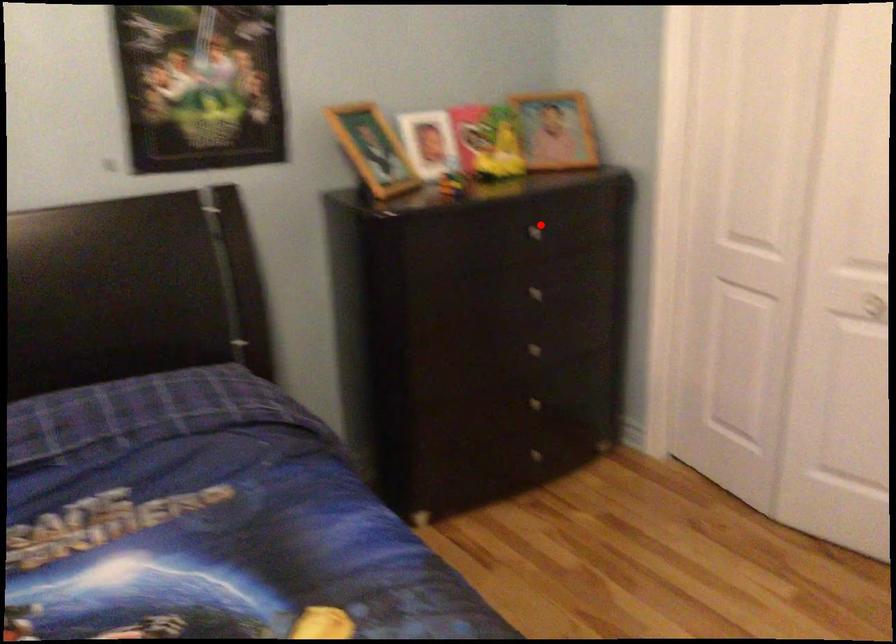
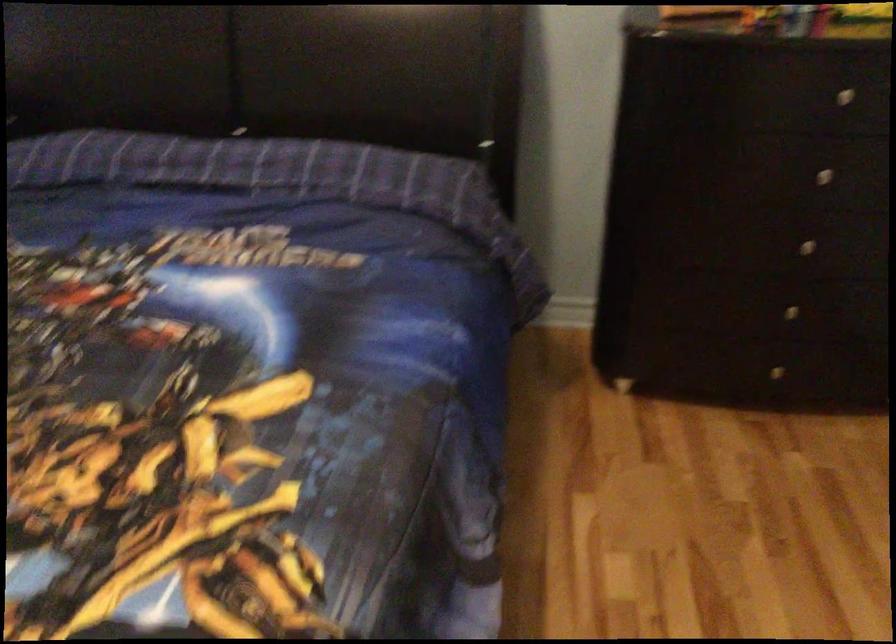
The point at the highlighted location is marked in the first image. Where is the corresponding point in the second image?

(858, 91)